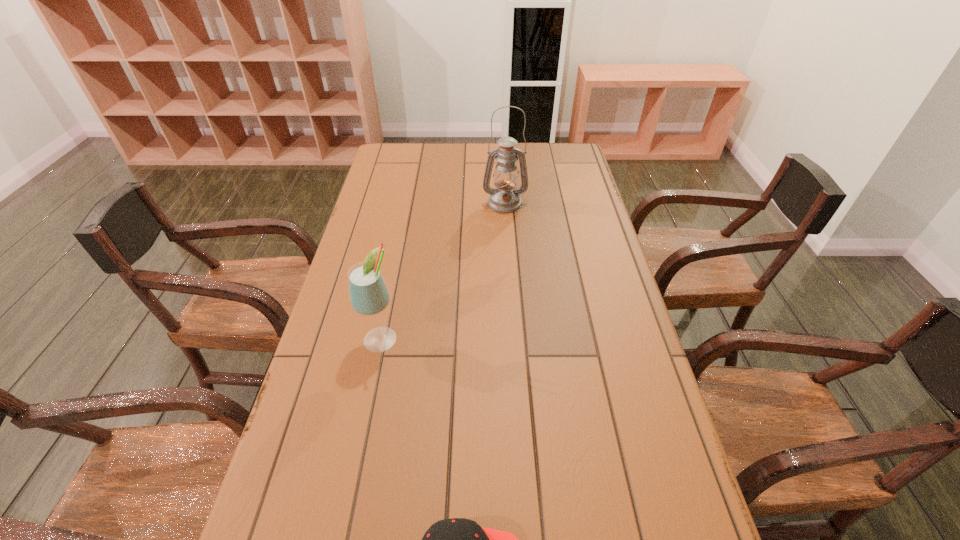
This screenshot has width=960, height=540. I want to click on vacant space at the far right corner, so click(552, 166).

Find the location of a particular element. The height and width of the screenshot is (540, 960). free space between the second shortest object and the oil lamp is located at coordinates (444, 271).

Locate an element on the screen. the closest object to the nearest object is located at coordinates (369, 295).

Locate an element on the screen. object that is the closest one to the cap is located at coordinates (369, 295).